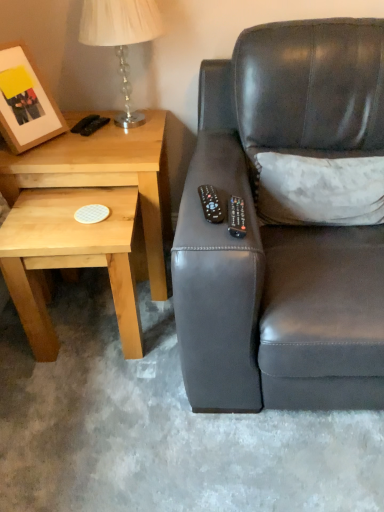
Where is `light wood/texture coaster at lower left`? This screenshot has width=384, height=512. light wood/texture coaster at lower left is located at coordinates (69, 258).

Identify the location of wooden matte picture frame at upper left. This screenshot has width=384, height=512. (25, 102).

Image resolution: width=384 pixels, height=512 pixels. What are the coordinates of `translucent glass table lamp at upper left` in the screenshot? It's located at (121, 38).

What are the coordinates of `white textured pillow at upper right` in the screenshot? It's located at (318, 189).

Between wooden matte picture frame at upper left and black plastic remote at upper right, marked as the 1th remote in a right-to-left arrangement, which one has smaller size?

With smaller size is black plastic remote at upper right, marked as the 1th remote in a right-to-left arrangement.

Can you see wooden matte picture frame at upper left touching black plastic remote at upper right, marked as the 1th remote in a right-to-left arrangement?

No.

In the image, is wooden matte picture frame at upper left positioned in front of or behind black plastic remote at upper right, the 2th remote viewed from the left?

In the image, wooden matte picture frame at upper left appears behind black plastic remote at upper right, the 2th remote viewed from the left.

From a real-world perspective, is wooden matte picture frame at upper left on black plastic remote at upper right, marked as the 1th remote in a right-to-left arrangement?

Yes, from a real-world perspective, wooden matte picture frame at upper left is over black plastic remote at upper right, marked as the 1th remote in a right-to-left arrangement

Choose the correct answer: Is white textured pillow at upper right inside translucent glass table lamp at upper left or outside it?

white textured pillow at upper right cannot be found inside translucent glass table lamp at upper left.

Does white textured pillow at upper right have a smaller size compared to translucent glass table lamp at upper left?

Yes, white textured pillow at upper right is smaller than translucent glass table lamp at upper left.

Is white textured pillow at upper right facing towards translucent glass table lamp at upper left?

No, white textured pillow at upper right is not turned towards translucent glass table lamp at upper left.

Is white textured pillow at upper right far from translucent glass table lamp at upper left?

No, white textured pillow at upper right is not far from translucent glass table lamp at upper left.

You are a GUI agent. You are given a task and a screenshot of the screen. Output one action in this format:
    pyautogui.click(x=<x>, y=<y>)
    Task: Click on the 2nd remote in front of the white textured pillow at upper right
    Image resolution: width=384 pixels, height=512 pixels.
    Given the screenshot: What is the action you would take?
    pyautogui.click(x=236, y=217)

Between white textured pillow at upper right and black plastic remote at upper right, the 2th remote viewed from the left, which one is positioned behind?

white textured pillow at upper right is more distant.

From the image's perspective, which is below, white textured pillow at upper right or black plastic remote at upper right, the 2th remote viewed from the left?

black plastic remote at upper right, the 2th remote viewed from the left.

Are light wood/texture coaster at lower left and wooden matte picture frame at upper left making contact?

light wood/texture coaster at lower left and wooden matte picture frame at upper left are not in contact.

How different are the orientations of light wood/texture coaster at lower left and wooden matte picture frame at upper left in degrees?

They differ by 58.5 degrees in their facing directions.

Is light wood/texture coaster at lower left surrounding wooden matte picture frame at upper left?

No, wooden matte picture frame at upper left is not surrounded by light wood/texture coaster at lower left.

Locate an element on the screen. The image size is (384, 512). remote that is the 2nd one when counting rightward from the light wood/textureobject at left is located at coordinates (236, 217).

From the image's perspective, between light wood/textureobject at left and black plastic remote at upper right, marked as the 1th remote in a right-to-left arrangement, who is located below?

black plastic remote at upper right, marked as the 1th remote in a right-to-left arrangement, is shown below in the image.

Which object is positioned more to the left, light wood/textureobject at left or black plastic remote at upper right, the 2th remote viewed from the left?

From the viewer's perspective, light wood/textureobject at left appears more on the left side.

From a real-world perspective, is light wood/textureobject at left physically located above or below black plastic remote at upper right, marked as the 1th remote in a right-to-left arrangement?

light wood/textureobject at left is situated lower than black plastic remote at upper right, marked as the 1th remote in a right-to-left arrangement, in the real world.

Can you confirm if translucent glass table lamp at upper left is taller than black plastic remote at upper right, the 2th remote viewed from the left?

Yes, translucent glass table lamp at upper left is taller than black plastic remote at upper right, the 2th remote viewed from the left.

Considering the sizes of objects translucent glass table lamp at upper left and black plastic remote at upper right, the 2th remote viewed from the left, in the image provided, who is smaller, translucent glass table lamp at upper left or black plastic remote at upper right, the 2th remote viewed from the left,?

black plastic remote at upper right, the 2th remote viewed from the left, is smaller.

From the picture: From a real-world perspective, relative to black plastic remote at upper right, marked as the 1th remote in a right-to-left arrangement, is translucent glass table lamp at upper left vertically above or below?

translucent glass table lamp at upper left is situated higher than black plastic remote at upper right, marked as the 1th remote in a right-to-left arrangement, in the real world.

From the image's perspective, which one is positioned higher, translucent glass table lamp at upper left or black plastic remote at upper right, the 2th remote viewed from the left?

translucent glass table lamp at upper left, from the image's perspective.

Considering the positions of point (78, 251) and point (240, 237), is point (78, 251) closer or farther from the camera than point (240, 237)?

Clearly, point (78, 251) is more distant from the camera than point (240, 237).

Is black plastic remote at upper right, the 2th remote viewed from the left, a part of light wood/texture coaster at lower left?

Actually, black plastic remote at upper right, the 2th remote viewed from the left, is outside light wood/texture coaster at lower left.

From the image's perspective, between light wood/texture coaster at lower left and black plastic remote at upper right, marked as the 1th remote in a right-to-left arrangement, who is located below?

light wood/texture coaster at lower left is shown below in the image.

Could you tell me if light wood/texture coaster at lower left is turned towards black plastic remote at upper right, the 2th remote viewed from the left?

No, light wood/texture coaster at lower left is not turned towards black plastic remote at upper right, the 2th remote viewed from the left.

You are a GUI agent. You are given a task and a screenshot of the screen. Output one action in this format:
    pyautogui.click(x=<x>, y=<y>)
    Task: Click on the picture frame behind the black plastic remote at upper right, the 2th remote viewed from the left
    This screenshot has width=384, height=512.
    Given the screenshot: What is the action you would take?
    pyautogui.click(x=25, y=102)

The width and height of the screenshot is (384, 512). Find the location of `throw pillow below the translucent glass table lamp at upper left (from a real-world perspective)`. throw pillow below the translucent glass table lamp at upper left (from a real-world perspective) is located at coordinates (318, 189).

Which object lies nearer to the anchor point black plastic remote at center, positioned as the 1th remote in left-to-right order, light wood/textureobject at left or matte black couch at right?

matte black couch at right lies closer to black plastic remote at center, positioned as the 1th remote in left-to-right order, than the other object.

When comparing their distances from black plastic remote at upper right, the 2th remote viewed from the left, does light wood/texture coaster at lower left or light wood/textureobject at left seem closer?

Based on the image, light wood/texture coaster at lower left appears to be nearer to black plastic remote at upper right, the 2th remote viewed from the left.

From the image, which object appears to be nearer to matte black couch at right, light wood/texture coaster at lower left or light wood/textureobject at left?

The object closer to matte black couch at right is light wood/texture coaster at lower left.

Based on their spatial positions, is matte black couch at right or wooden matte picture frame at upper left further from black plastic remote at center, the second remote from the right?

wooden matte picture frame at upper left is positioned further to the anchor black plastic remote at center, the second remote from the right.

Looking at the image, which one is located closer to matte black couch at right, black plastic remote at center, positioned as the 1th remote in left-to-right order, or light wood/textureobject at left?

black plastic remote at center, positioned as the 1th remote in left-to-right order, lies closer to matte black couch at right than the other object.

From the image, which object appears to be farther from light wood/texture coaster at lower left, black plastic remote at center, the second remote from the right, or black plastic remote at upper right, the 2th remote viewed from the left?

Based on the image, black plastic remote at upper right, the 2th remote viewed from the left, appears to be further to light wood/texture coaster at lower left.

Considering their positions, is black plastic remote at center, positioned as the 1th remote in left-to-right order, positioned further to wooden matte picture frame at upper left than light wood/textureobject at left?

The object further to wooden matte picture frame at upper left is black plastic remote at center, positioned as the 1th remote in left-to-right order.

Considering their positions, is black plastic remote at center, positioned as the 1th remote in left-to-right order, positioned closer to light wood/texture coaster at lower left than matte black couch at right?

matte black couch at right is closer to light wood/texture coaster at lower left.

This screenshot has width=384, height=512. In order to click on remote located between light wood/textureobject at left and black plastic remote at upper right, the 2th remote viewed from the left, in the left-right direction in this screenshot , I will do `click(211, 204)`.

You are a GUI agent. You are given a task and a screenshot of the screen. Output one action in this format:
    pyautogui.click(x=<x>, y=<y>)
    Task: Click on the remote located between wooden matte picture frame at upper left and black plastic remote at upper right, the 2th remote viewed from the left, in the left-right direction
    This screenshot has height=512, width=384.
    Given the screenshot: What is the action you would take?
    pyautogui.click(x=211, y=204)

The width and height of the screenshot is (384, 512). In order to click on picture frame between translucent glass table lamp at upper left and light wood/textureobject at left from top to bottom in this screenshot , I will do `click(25, 102)`.

This screenshot has height=512, width=384. Identify the location of coffee table situated between wooden matte picture frame at upper left and white textured pillow at upper right from left to right. (69, 258).